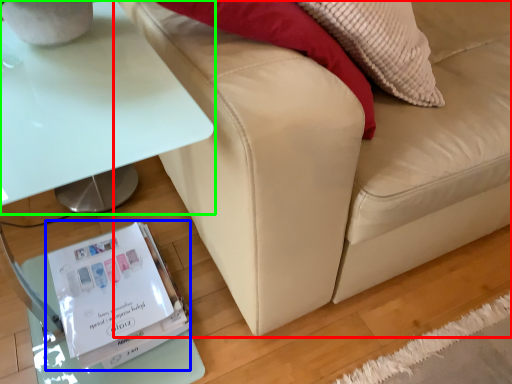
Question: Considering the real-world distances, which object is farthest from studio couch (highlighted by a red box)? paperback book (highlighted by a blue box) or table (highlighted by a green box)?

Choices:
 (A) paperback book
 (B) table

Answer: (A)